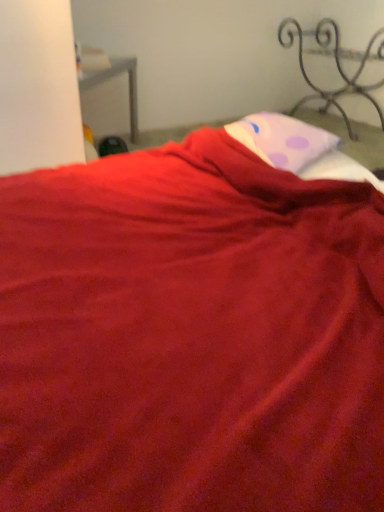
Question: From their relative heights in the image, would you say iron/textured metal bed frame at upper right is taller or shorter than pink dotted pillow at upper center?

Choices:
 (A) short
 (B) tall

Answer: (B)

Question: Which is correct: iron/textured metal bed frame at upper right is inside pink dotted pillow at upper center, or outside of it?

Choices:
 (A) outside
 (B) inside

Answer: (A)

Question: From a real-world perspective, is iron/textured metal bed frame at upper right above or below pink dotted pillow at upper center?

Choices:
 (A) above
 (B) below

Answer: (B)

Question: Is point (286, 125) closer or farther from the camera than point (354, 84)?

Choices:
 (A) farther
 (B) closer

Answer: (B)

Question: Is pink dotted pillow at upper center taller or shorter than iron/textured metal bed frame at upper right?

Choices:
 (A) short
 (B) tall

Answer: (A)

Question: From a real-world perspective, is pink dotted pillow at upper center positioned above or below iron/textured metal bed frame at upper right?

Choices:
 (A) below
 (B) above

Answer: (B)

Question: Would you say pink dotted pillow at upper center is to the left or to the right of iron/textured metal bed frame at upper right in the picture?

Choices:
 (A) right
 (B) left

Answer: (B)